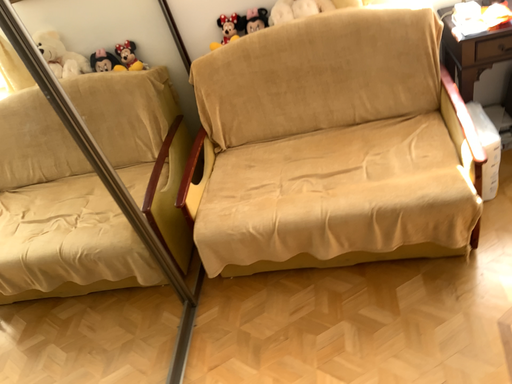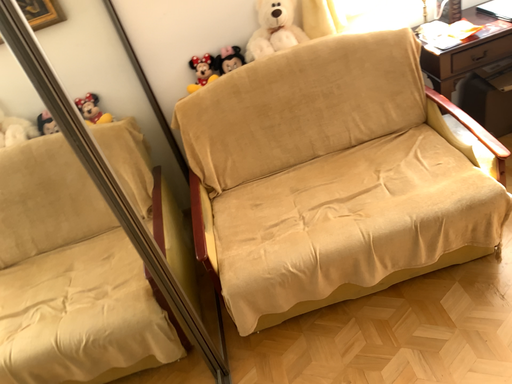
Question: Which way did the camera rotate in the video?

Choices:
 (A) rotated upward
 (B) rotated downward

Answer: (A)